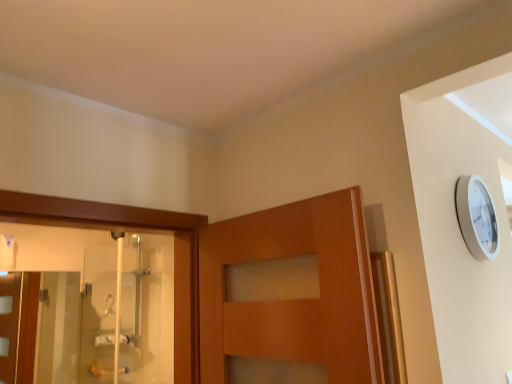
Question: From the image's perspective, is clear glass shower door at left, the second screen door positioned from the left, located beneath transparent glass screen door at left, which is the second screen door from right to left?

Choices:
 (A) yes
 (B) no

Answer: (B)

Question: Considering the relative sizes of clear glass shower door at left, the second screen door positioned from the left, and transparent glass screen door at left, which is the second screen door from right to left, in the image provided, is clear glass shower door at left, the second screen door positioned from the left, taller than transparent glass screen door at left, which is the second screen door from right to left,?

Choices:
 (A) no
 (B) yes

Answer: (B)

Question: Is clear glass shower door at left, the second screen door positioned from the left, positioned with its back to transparent glass screen door at left, which is the second screen door from right to left?

Choices:
 (A) yes
 (B) no

Answer: (B)

Question: Is there a large distance between clear glass shower door at left, the second screen door positioned from the left, and transparent glass screen door at left, which is the second screen door from right to left?

Choices:
 (A) yes
 (B) no

Answer: (B)

Question: Is the depth of clear glass shower door at left, the second screen door positioned from the left, greater than that of transparent glass screen door at left, which is the second screen door from right to left?

Choices:
 (A) yes
 (B) no

Answer: (B)

Question: Is clear glass shower door at left, the second screen door positioned from the left, not within transparent glass screen door at left, which is the first screen door from left to right?

Choices:
 (A) yes
 (B) no

Answer: (A)

Question: Considering the relative positions of transparent glass screen door at left, which is the second screen door from right to left, and clear glass shower door at left, the second screen door positioned from the left, in the image provided, is transparent glass screen door at left, which is the second screen door from right to left, to the right of clear glass shower door at left, the second screen door positioned from the left, from the viewer's perspective?

Choices:
 (A) yes
 (B) no

Answer: (B)

Question: Considering the relative sizes of transparent glass screen door at left, which is the second screen door from right to left, and clear glass shower door at left, the second screen door positioned from the left, in the image provided, is transparent glass screen door at left, which is the second screen door from right to left, bigger than clear glass shower door at left, the second screen door positioned from the left,?

Choices:
 (A) yes
 (B) no

Answer: (A)

Question: Can you confirm if transparent glass screen door at left, which is the first screen door from left to right, is thinner than clear glass shower door at left, the second screen door positioned from the left?

Choices:
 (A) yes
 (B) no

Answer: (B)

Question: Does transparent glass screen door at left, which is the second screen door from right to left, have a smaller size compared to clear glass shower door at left, the second screen door positioned from the left?

Choices:
 (A) yes
 (B) no

Answer: (B)

Question: Does transparent glass screen door at left, which is the first screen door from left to right, touch clear glass shower door at left, which is the first screen door from right to left?

Choices:
 (A) yes
 (B) no

Answer: (B)

Question: Is transparent glass screen door at left, which is the second screen door from right to left, facing away from clear glass shower door at left, which is the first screen door from right to left?

Choices:
 (A) no
 (B) yes

Answer: (A)

Question: Based on their sizes in the image, would you say clear glass shower door at left, which is the first screen door from right to left, is bigger or smaller than transparent glass screen door at left, which is the second screen door from right to left?

Choices:
 (A) small
 (B) big

Answer: (A)